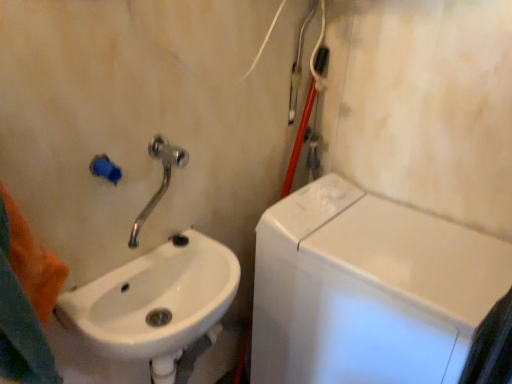
Question: Can you confirm if white glossy washing machine at right is thinner than silver metallic faucet at upper left?

Choices:
 (A) yes
 (B) no

Answer: (B)

Question: Is white glossy washing machine at right taller than silver metallic faucet at upper left?

Choices:
 (A) no
 (B) yes

Answer: (B)

Question: Is there a large distance between white glossy washing machine at right and silver metallic faucet at upper left?

Choices:
 (A) no
 (B) yes

Answer: (A)

Question: Is white glossy washing machine at right turned away from silver metallic faucet at upper left?

Choices:
 (A) yes
 (B) no

Answer: (B)

Question: Is white glossy washing machine at right positioned before silver metallic faucet at upper left?

Choices:
 (A) yes
 (B) no

Answer: (B)

Question: Do you think silver metallic faucet at upper left is within white glossy sink at lower left, or outside of it?

Choices:
 (A) outside
 (B) inside

Answer: (A)

Question: Considering the positions of silver metallic faucet at upper left and white glossy sink at lower left in the image, is silver metallic faucet at upper left taller or shorter than white glossy sink at lower left?

Choices:
 (A) tall
 (B) short

Answer: (A)

Question: Is point coord(148,142) positioned closer to the camera than point coord(152,269)?

Choices:
 (A) farther
 (B) closer

Answer: (B)

Question: From a real-world perspective, is silver metallic faucet at upper left physically located above or below white glossy sink at lower left?

Choices:
 (A) above
 (B) below

Answer: (A)

Question: In terms of width, does white glossy sink at lower left look wider or thinner when compared to silver metallic faucet at upper left?

Choices:
 (A) wide
 (B) thin

Answer: (A)

Question: Visually, is white glossy sink at lower left positioned to the left or to the right of silver metallic faucet at upper left?

Choices:
 (A) left
 (B) right

Answer: (B)

Question: From the image's perspective, is white glossy sink at lower left positioned above or below silver metallic faucet at upper left?

Choices:
 (A) above
 (B) below

Answer: (B)

Question: Considering the positions of point (109, 292) and point (184, 157), is point (109, 292) closer or farther from the camera than point (184, 157)?

Choices:
 (A) farther
 (B) closer

Answer: (B)

Question: Considering the positions of white glossy washing machine at right and white glossy sink at lower left in the image, is white glossy washing machine at right taller or shorter than white glossy sink at lower left?

Choices:
 (A) short
 (B) tall

Answer: (B)

Question: In terms of size, does white glossy washing machine at right appear bigger or smaller than white glossy sink at lower left?

Choices:
 (A) big
 (B) small

Answer: (A)